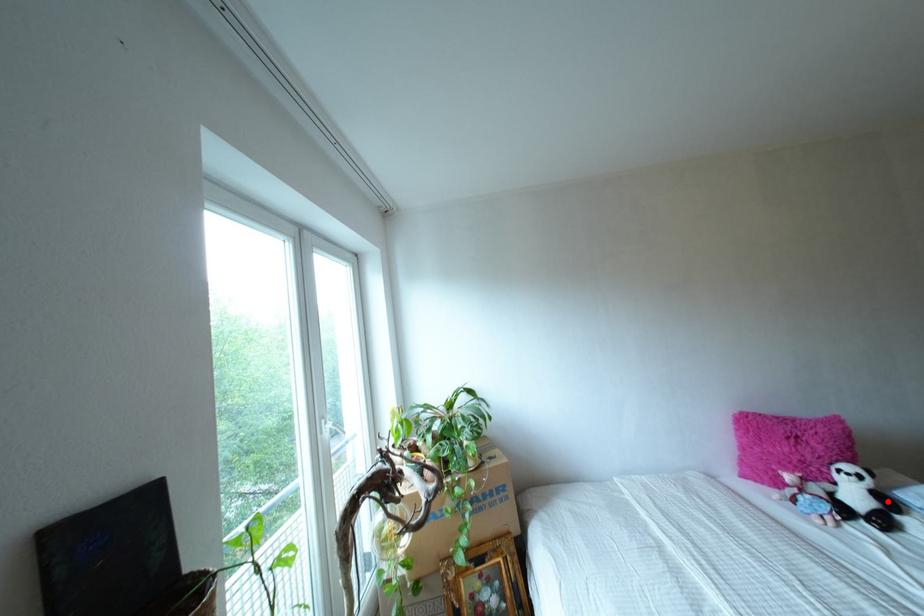
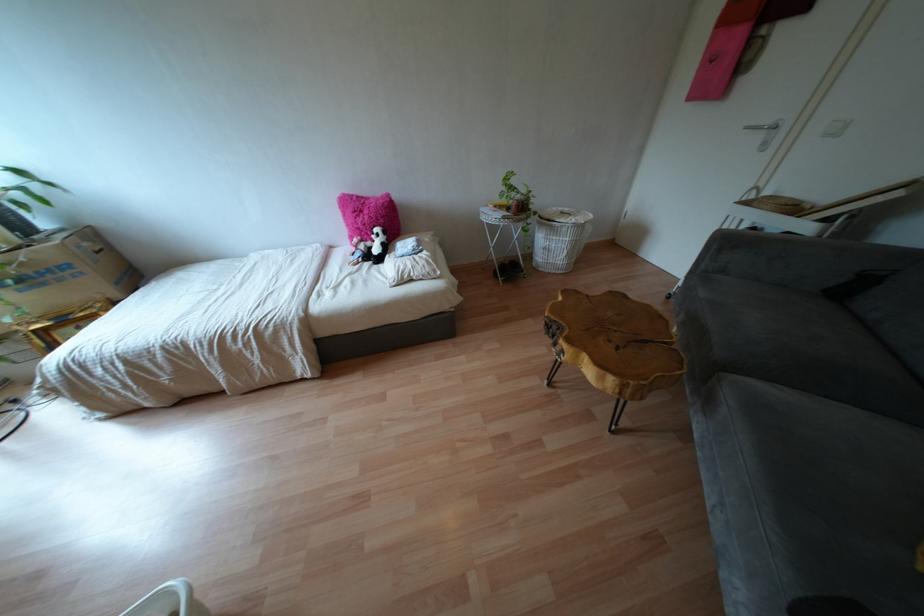
Question: I am providing you with two images of the same scene from different viewpoints. A red point is shown in image1. For the corresponding object point in image2, is it positioned nearer or farther from the camera?

Choices:
 (A) Nearer
 (B) Farther

Answer: (B)